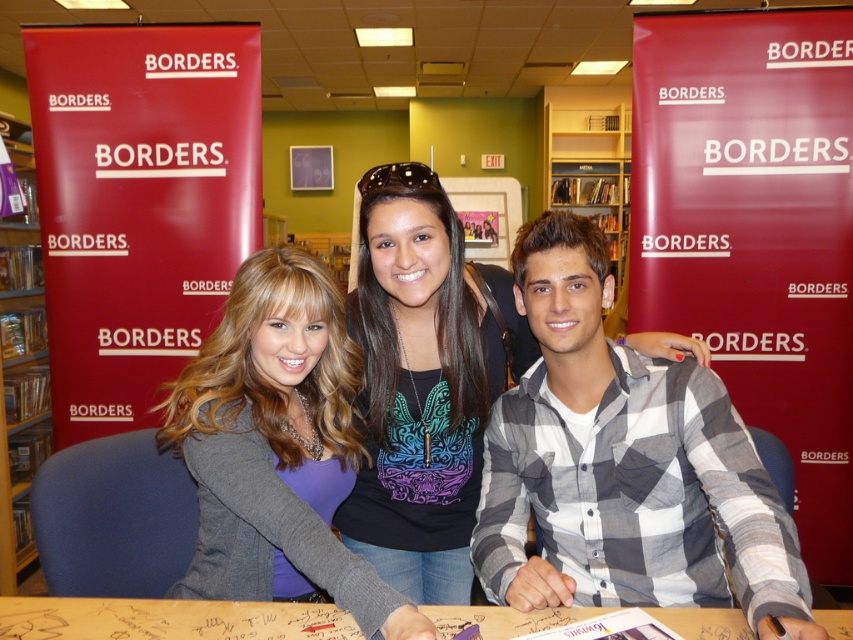
You are standing in the Borders bookstore and see the gray checkered shirt at center and the wooden bookshelf at left. Which object is closer to the camera?

The gray checkered shirt at center is closer to the camera because it is positioned below the wooden bookshelf at left, indicating it is in front of it.